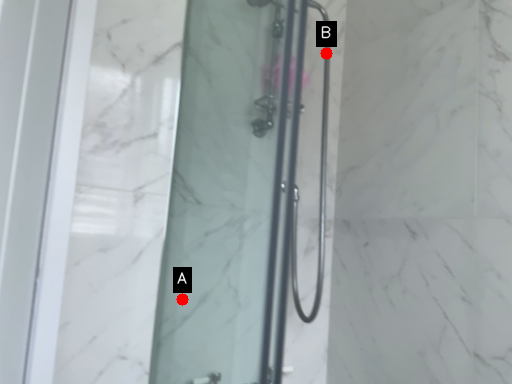
Question: Two points are circled on the image, labeled by A and B beside each circle. Which point is closer to the camera?

Choices:
 (A) A is closer
 (B) B is closer

Answer: (A)